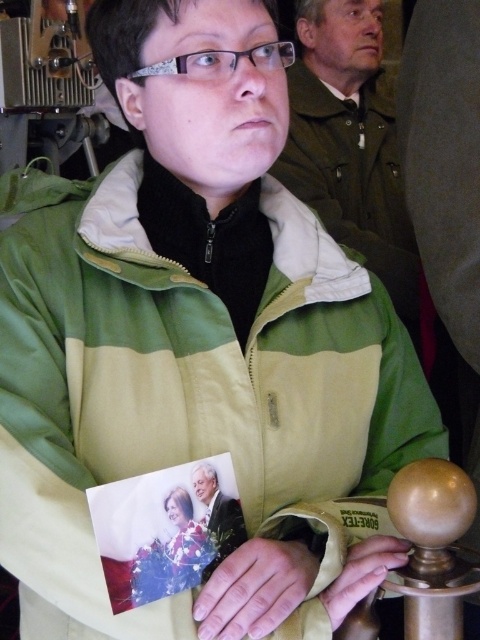
Based on the scene described, which object is bigger in size between the smooth skin hand at center and the matte gold handle at lower center?

The smooth skin hand at center is larger in size compared to the matte gold handle at lower center according to the description.